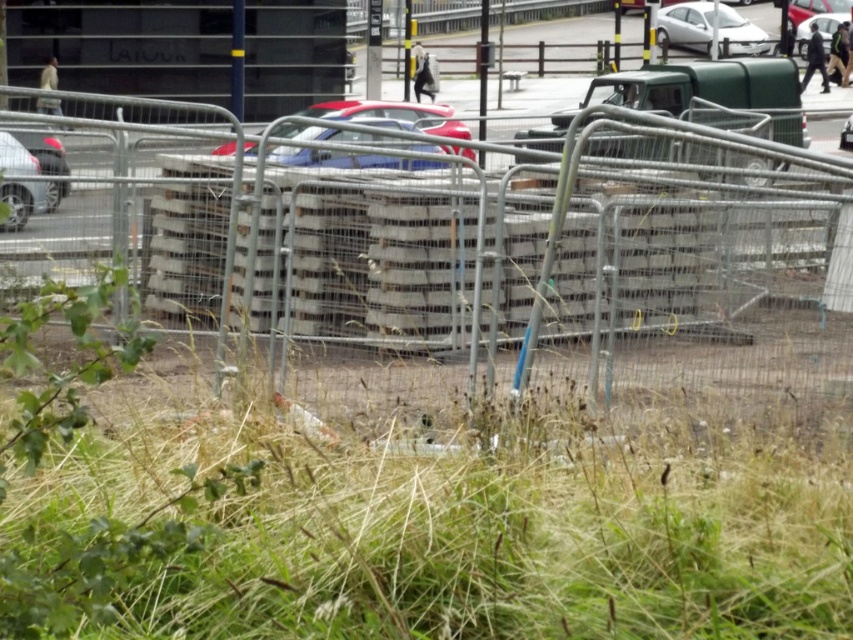
You are a pedestrian standing at the edge of the street. You see the green leafy weed at lower left and the metallic blue sedan at center. Which object is closer to you?

The green leafy weed at lower left is closer to you because it is in front of the metallic blue sedan at center, indicating it is nearer in the scene.

You are a delivery driver needing to park your vehicle in this area. The white glossy car at upper center is currently occupying a spot. Can you safely park your vehicle in the same spot without overlapping it?

The white glossy car at upper center is located at point (x=686, y=24), so you cannot park your vehicle in the same spot without overlapping it as the coordinates indicate its exact position.

You are a delivery driver who needs to park your truck between the white glossy car at upper center and the shiny metallic car at left. Based on the scene, can you determine if there is enough space between them to fit your truck which is 2.5 meters wide?

The white glossy car at upper center might be wider than the shiny metallic car at left, but without exact measurements, it is uncertain if the space between them can accommodate a 2.5 meter wide truck. You should check the actual width before proceeding.